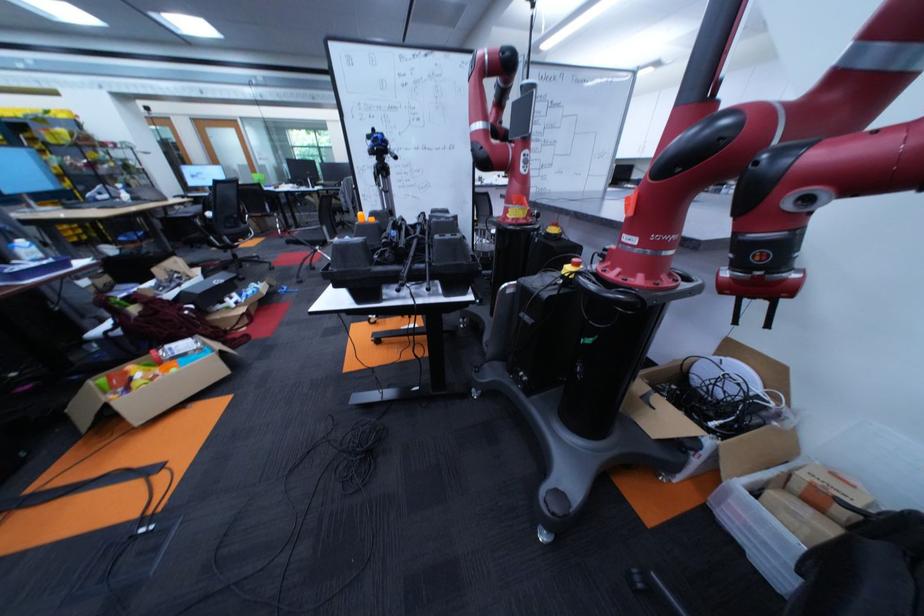
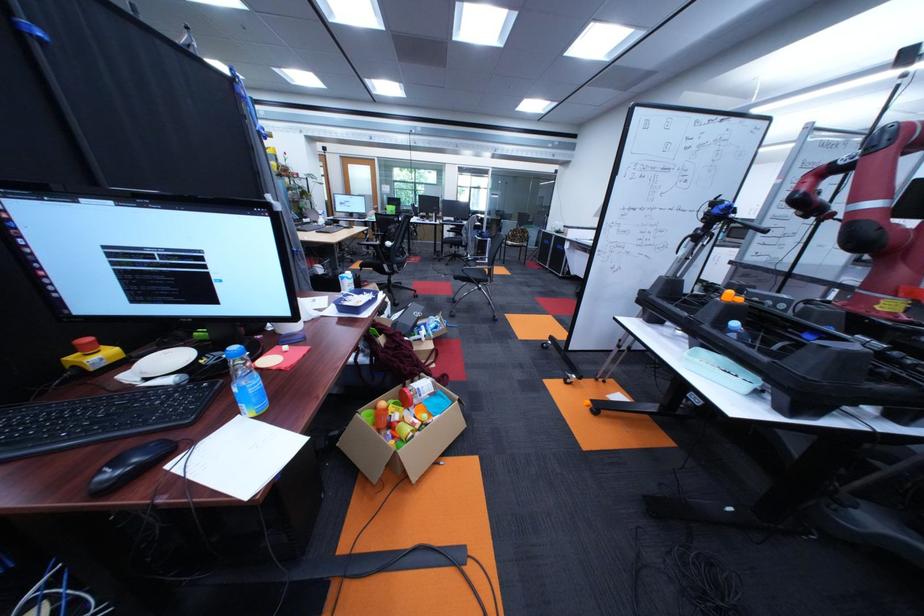
Question: What movement of the cameraman would produce the second image?

Choices:
 (A) Left
 (B) Right
 (C) Forward
 (D) Backward

Answer: (A)